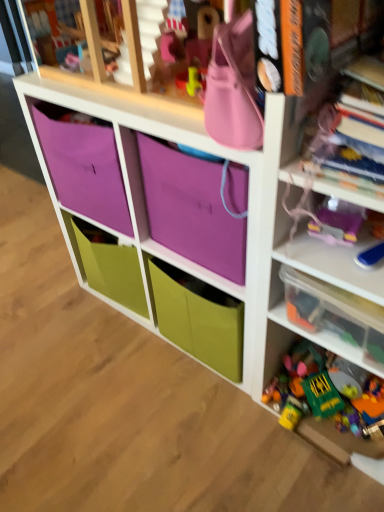
At what (x,y) coordinates should I click in order to perform the action: click on purple fabric bag at upper center. Please return your answer as a coordinate pair (x, y). The width and height of the screenshot is (384, 512). Looking at the image, I should click on coord(191,209).

What is the approximate height of plastic colorful toys at lower right?

It is 5.70 inches.

Where is `plastic colorful toys at lower right`? The image size is (384, 512). plastic colorful toys at lower right is located at coordinates (326, 386).

Image resolution: width=384 pixels, height=512 pixels. Describe the element at coordinates (144, 194) in the screenshot. I see `purple fabric storage at center` at that location.

The width and height of the screenshot is (384, 512). Describe the element at coordinates (315, 197) in the screenshot. I see `translucent plastic toys at right` at that location.

The image size is (384, 512). What are the coordinates of `clear plastic container at right` in the screenshot? It's located at (333, 316).

Where is `purple fabric bag at upper center`? Image resolution: width=384 pixels, height=512 pixels. purple fabric bag at upper center is located at coordinates (191, 209).

From a real-world perspective, who is located lower, purple fabric storage at center or translucent plastic toys at right?

From a 3D spatial view, purple fabric storage at center is below.

Considering the relative sizes of purple fabric storage at center and translucent plastic toys at right in the image provided, is purple fabric storage at center smaller than translucent plastic toys at right?

Incorrect, purple fabric storage at center is not smaller in size than translucent plastic toys at right.

Is purple fabric storage at center in front of translucent plastic toys at right?

No, it is behind translucent plastic toys at right.

Between point (159, 113) and point (280, 164), which one is positioned in front?

The point (280, 164) is closer.

Considering the points (218, 224) and (318, 374), which point is in front, point (218, 224) or point (318, 374)?

Point (218, 224)

Is purple fabric bag at upper center next to plastic colorful toys at lower right?

purple fabric bag at upper center and plastic colorful toys at lower right are clearly separated.

Which object is positioned more to the right, purple fabric bag at upper center or plastic colorful toys at lower right?

plastic colorful toys at lower right is more to the right.

Which object is closer to the camera taking this photo, purple fabric bag at upper center or plastic colorful toys at lower right?

purple fabric bag at upper center is more forward.

What's the angular difference between purple fabric storage at center and plastic colorful toys at lower right's facing directions?

They differ by 0.256 degrees in their facing directions.

Consider the image. Would you say purple fabric storage at center is a long distance from plastic colorful toys at lower right?

Actually, purple fabric storage at center and plastic colorful toys at lower right are a little close together.

Is purple fabric storage at center positioned behind plastic colorful toys at lower right?

No, purple fabric storage at center is closer to the viewer.

From a real-world perspective, is purple fabric storage at center positioned above or below plastic colorful toys at lower right?

From a real-world perspective, purple fabric storage at center is physically above plastic colorful toys at lower right.

From a real-world perspective, does translucent plastic toys at right stand above purple fabric bag at upper center?

No, from a real-world perspective, translucent plastic toys at right is not on top of purple fabric bag at upper center.

Considering the relative positions of translucent plastic toys at right and purple fabric bag at upper center in the image provided, is translucent plastic toys at right to the left or to the right of purple fabric bag at upper center?

Clearly, translucent plastic toys at right is on the right of purple fabric bag at upper center in the image.

Is translucent plastic toys at right oriented away from purple fabric bag at upper center?

No, translucent plastic toys at right is not facing away from purple fabric bag at upper center.

Is clear plastic container at right positioned with its back to purple fabric bag at upper center?

No, clear plastic container at right is not facing the opposite direction of purple fabric bag at upper center.

Considering the positions of objects clear plastic container at right and purple fabric bag at upper center in the image provided, who is behind, clear plastic container at right or purple fabric bag at upper center?

purple fabric bag at upper center.

Is point (279, 314) more distant than point (188, 227)?

That is False.

Between clear plastic container at right and purple fabric bag at upper center, which one appears on the left side from the viewer's perspective?

From the viewer's perspective, purple fabric bag at upper center appears more on the left side.

Considering the positions of objects purple fabric bag at upper center and translucent plastic toys at right in the image provided, who is more to the left, purple fabric bag at upper center or translucent plastic toys at right?

From the viewer's perspective, purple fabric bag at upper center appears more on the left side.

Which object is closer to the camera, purple fabric bag at upper center or translucent plastic toys at right?

Positioned in front is translucent plastic toys at right.

From the picture: Considering the sizes of purple fabric bag at upper center and translucent plastic toys at right in the image, is purple fabric bag at upper center taller or shorter than translucent plastic toys at right?

Considering their sizes, purple fabric bag at upper center has less height than translucent plastic toys at right.

From the image's perspective, is purple fabric bag at upper center located above translucent plastic toys at right?

Yes.

From a real-world perspective, between translucent plastic toys at right and plastic colorful toys at lower right, who is vertically higher?

translucent plastic toys at right.

Is there a large distance between translucent plastic toys at right and plastic colorful toys at lower right?

No.

Based on their positions, is translucent plastic toys at right located to the left or right of plastic colorful toys at lower right?

translucent plastic toys at right is to the right of plastic colorful toys at lower right.

Could you tell me if translucent plastic toys at right is turned towards plastic colorful toys at lower right?

Yes, translucent plastic toys at right faces towards plastic colorful toys at lower right.

The image size is (384, 512). Find the location of `bookshelf that appears on the right of purple fabric storage at center`. bookshelf that appears on the right of purple fabric storage at center is located at coordinates (315, 197).

You are a GUI agent. You are given a task and a screenshot of the screen. Output one action in this format:
    pyautogui.click(x=<x>, y=<y>)
    Task: Click on the storage box in front of the plastic colorful toys at lower right
    This screenshot has width=384, height=512.
    Given the screenshot: What is the action you would take?
    pyautogui.click(x=191, y=209)

Looking at the image, which one is located further to purple fabric bag at upper center, purple fabric storage at center or clear plastic container at right?

clear plastic container at right lies further to purple fabric bag at upper center than the other object.

Considering their positions, is clear plastic container at right positioned further to plastic colorful toys at lower right than purple fabric bag at upper center?

Among the two, purple fabric bag at upper center is located further to plastic colorful toys at lower right.

Considering their positions, is plastic colorful toys at lower right positioned further to purple fabric bag at upper center than translucent plastic toys at right?

plastic colorful toys at lower right.

Considering their positions, is plastic colorful toys at lower right positioned further to purple fabric storage at center than purple fabric bag at upper center?

plastic colorful toys at lower right lies further to purple fabric storage at center than the other object.

In the scene shown: From the image, which object appears to be nearer to translucent plastic toys at right, purple fabric bag at upper center or clear plastic container at right?

Among the two, clear plastic container at right is located nearer to translucent plastic toys at right.

Estimate the real-world distances between objects in this image. Which object is closer to purple fabric bag at upper center, clear plastic container at right or plastic colorful toys at lower right?

Among the two, clear plastic container at right is located nearer to purple fabric bag at upper center.

From the image, which object appears to be nearer to purple fabric bag at upper center, plastic colorful toys at lower right or clear plastic container at right?

clear plastic container at right is positioned closer to the anchor purple fabric bag at upper center.

Estimate the real-world distances between objects in this image. Which object is further from clear plastic container at right, purple fabric bag at upper center or translucent plastic toys at right?

purple fabric bag at upper center lies further to clear plastic container at right than the other object.

Locate an element on the screen. This screenshot has height=512, width=384. shelf that lies between purple fabric bag at upper center and plastic colorful toys at lower right from top to bottom is located at coordinates (333, 316).

In order to click on cabinet between translucent plastic toys at right and plastic colorful toys at lower right from front to back in this screenshot , I will do `click(144, 194)`.

The height and width of the screenshot is (512, 384). Find the location of `storage box situated between purple fabric storage at center and translucent plastic toys at right from left to right`. storage box situated between purple fabric storage at center and translucent plastic toys at right from left to right is located at coordinates (191, 209).

Find the location of a particular element. shelf located between translucent plastic toys at right and plastic colorful toys at lower right in the depth direction is located at coordinates (333, 316).